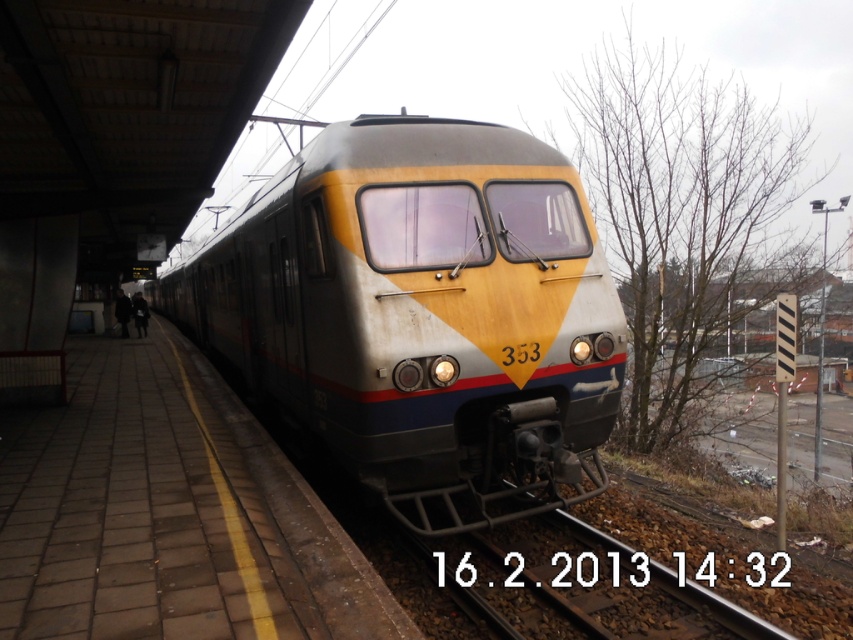
Question: Is matte gray train at center positioned before brown gravel train track at lower center?

Choices:
 (A) no
 (B) yes

Answer: (A)

Question: Is matte gray train at center thinner than brown gravel train track at lower center?

Choices:
 (A) yes
 (B) no

Answer: (B)

Question: Among these objects, which one is nearest to the camera?

Choices:
 (A) brown gravel train track at lower center
 (B) matte gray train at center

Answer: (A)

Question: Can you confirm if matte gray train at center is smaller than brown gravel train track at lower center?

Choices:
 (A) yes
 (B) no

Answer: (B)

Question: Among these points, which one is nearest to the camera?

Choices:
 (A) (315, 404)
 (B) (590, 632)

Answer: (B)

Question: Which of the following is the closest to the observer?

Choices:
 (A) click(x=531, y=461)
 (B) click(x=677, y=596)

Answer: (B)